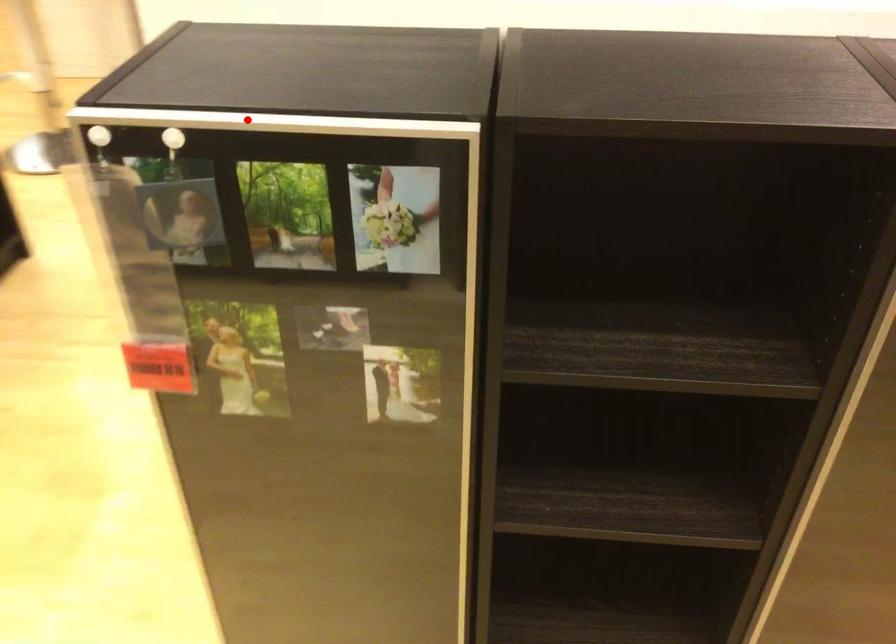
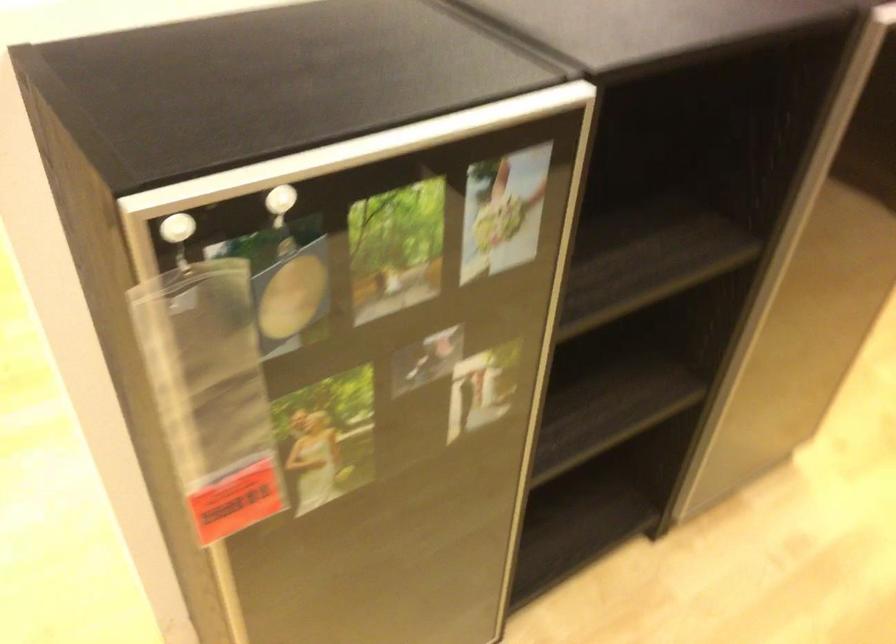
Locate, in the second image, the point that corresponds to the highlighted location in the first image.

(356, 152)